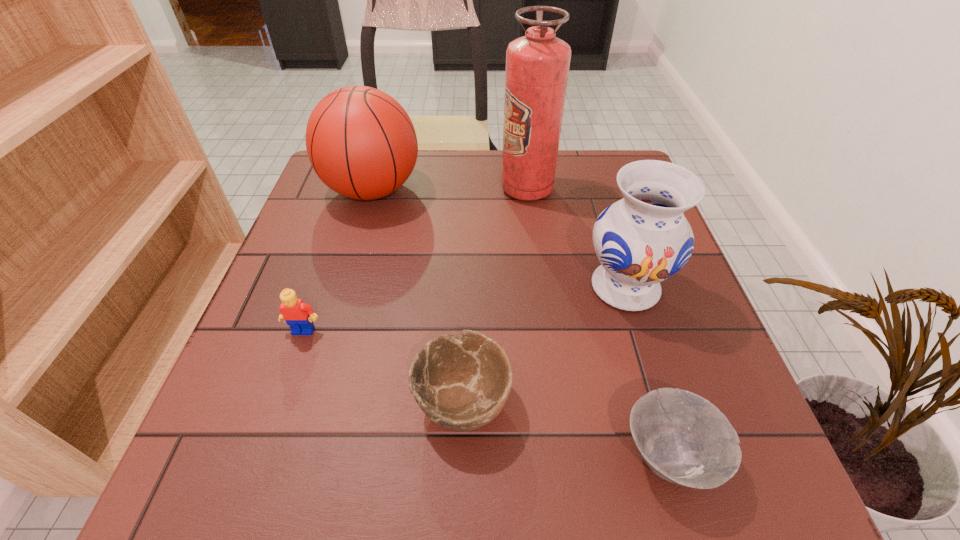
Find the location of a particular element. Image resolution: width=960 pixels, height=540 pixels. fire extinguisher is located at coordinates click(x=537, y=65).

This screenshot has width=960, height=540. I want to click on the tallest object, so click(537, 65).

The width and height of the screenshot is (960, 540). I want to click on basketball, so click(360, 141).

Where is `the fourth nearest object`? the fourth nearest object is located at coordinates (643, 239).

Where is `Lego`? Image resolution: width=960 pixels, height=540 pixels. Lego is located at coordinates (299, 316).

This screenshot has height=540, width=960. Find the location of `the fourth farthest object`. the fourth farthest object is located at coordinates (299, 316).

The height and width of the screenshot is (540, 960). What are the coordinates of `the fourth object from right to left` in the screenshot? It's located at (464, 384).

In order to click on the left bowl in this screenshot , I will do `click(464, 384)`.

This screenshot has width=960, height=540. I want to click on the shorter bowl, so click(683, 438).

Locate an element on the screen. The width and height of the screenshot is (960, 540). the right bowl is located at coordinates (683, 438).